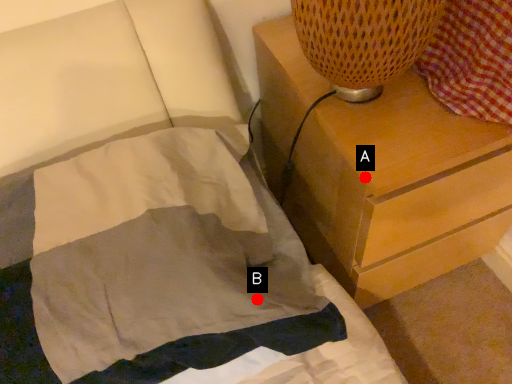
Question: Two points are circled on the image, labeled by A and B beside each circle. Which point is closer to the camera?

Choices:
 (A) A is closer
 (B) B is closer

Answer: (B)